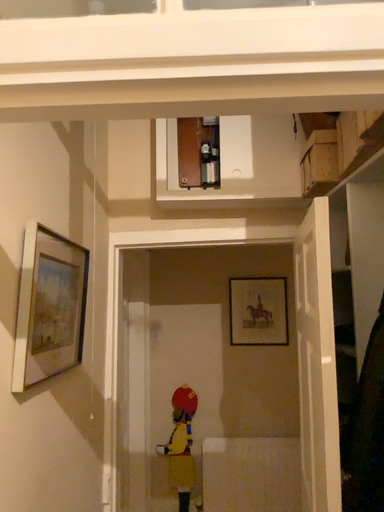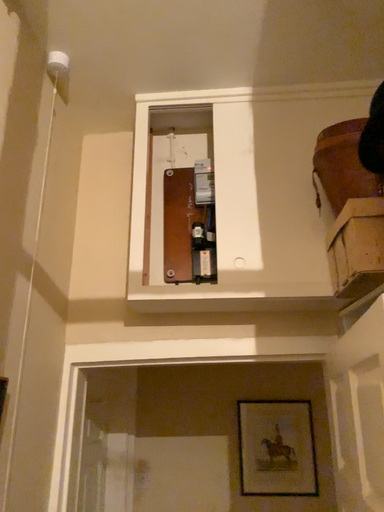
Question: Which way did the camera rotate in the video?

Choices:
 (A) rotated upward
 (B) rotated downward

Answer: (A)